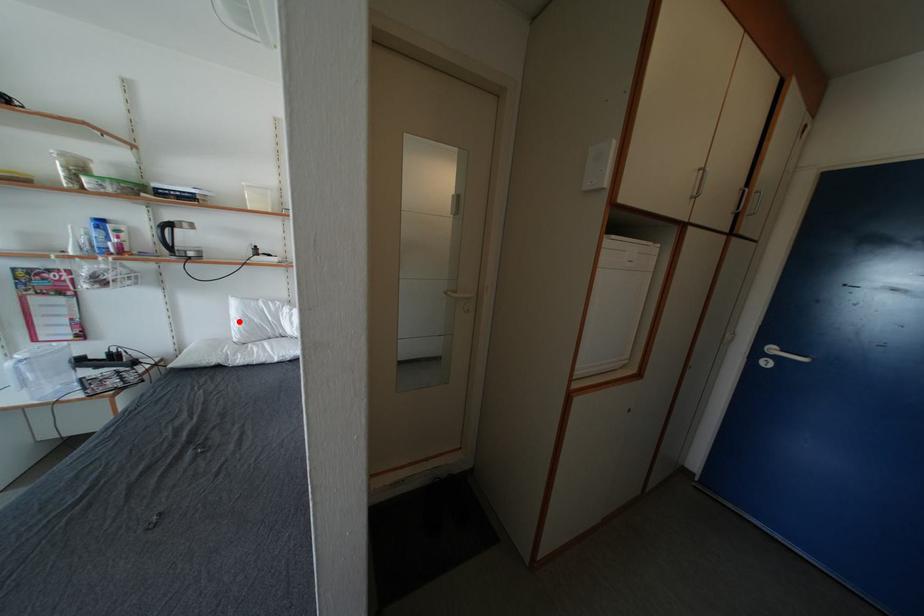
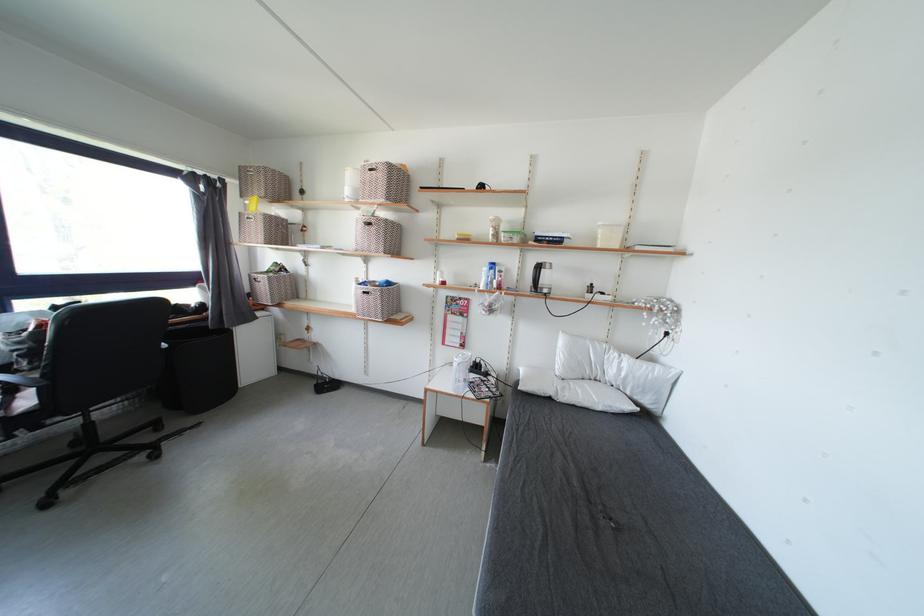
Where in the second image is the point corresponding to the highlighted location from the first image?

(565, 355)